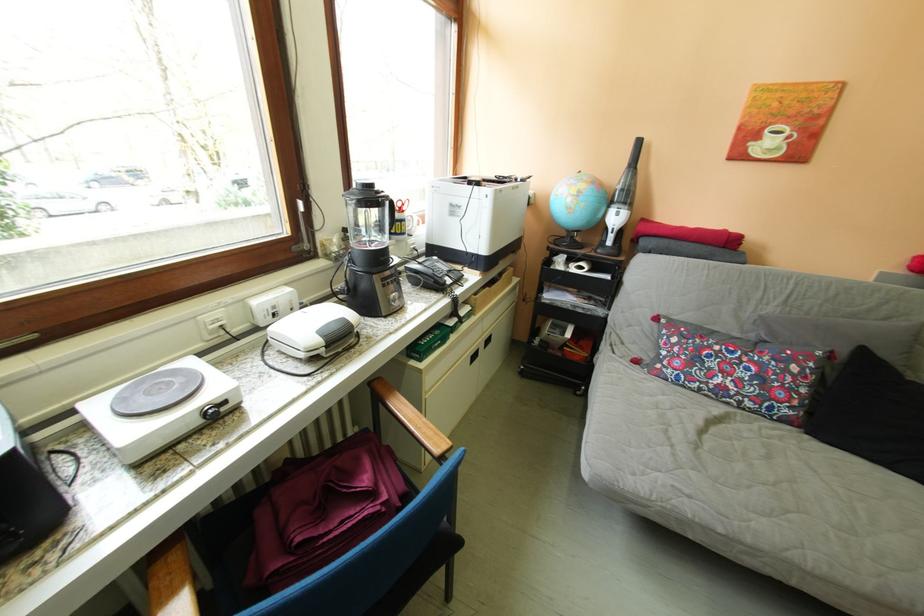
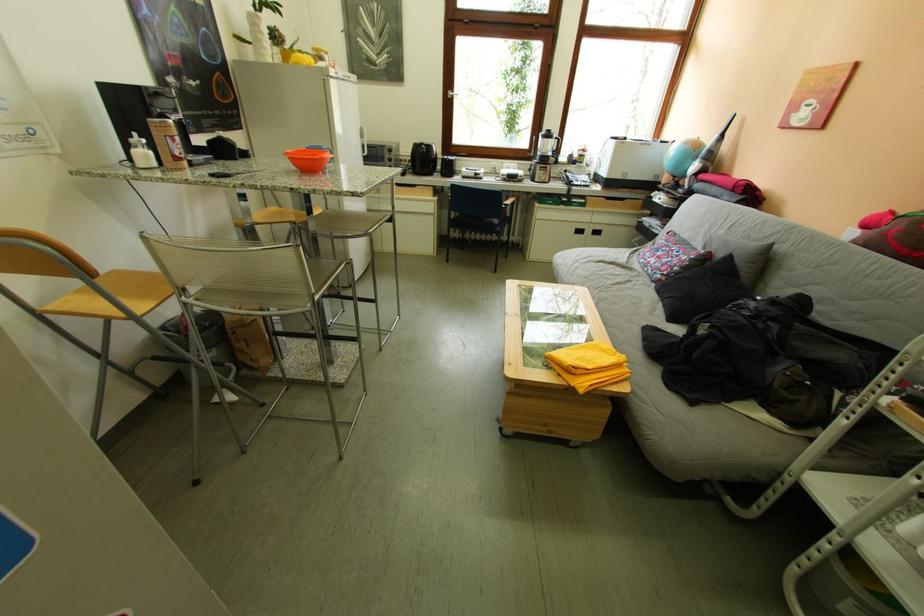
Find the pixel in the second image that matches (541,180) in the first image.

(687, 145)